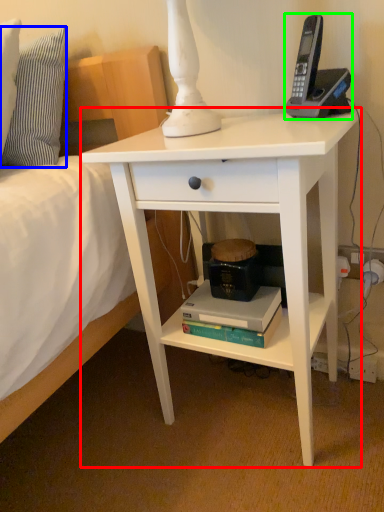
Question: Which is nearer to the desk (highlighted by a red box)? pillow (highlighted by a blue box) or corded phone (highlighted by a green box).

Choices:
 (A) pillow
 (B) corded phone

Answer: (B)